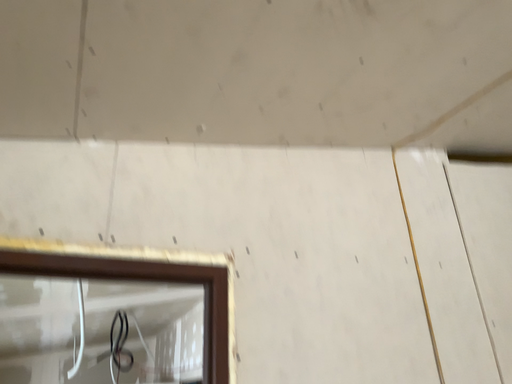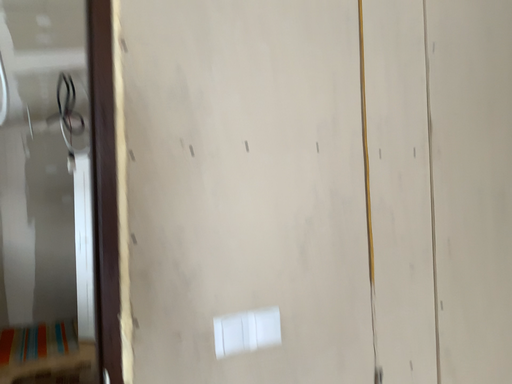
Question: How did the camera likely rotate when shooting the video?

Choices:
 (A) rotated upward
 (B) rotated downward

Answer: (B)